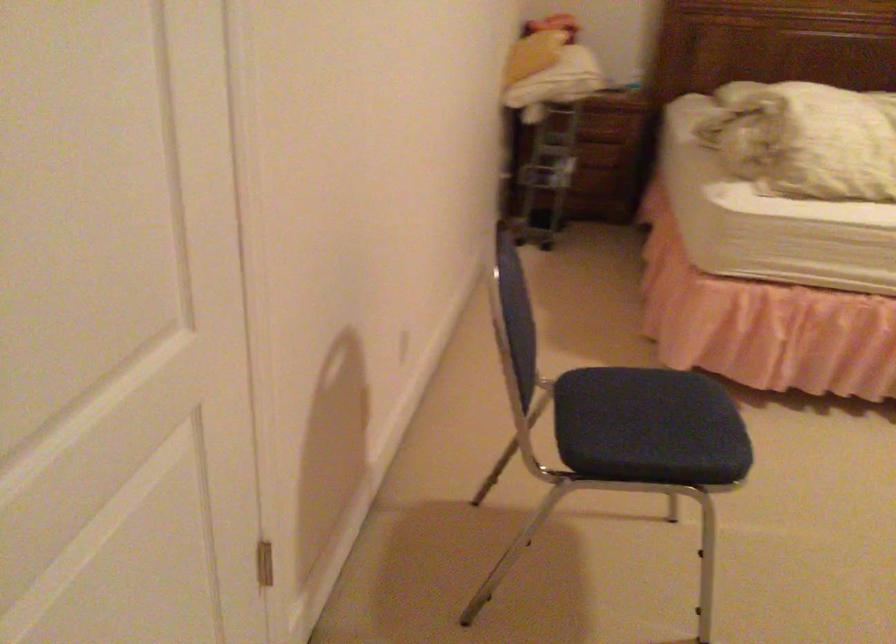
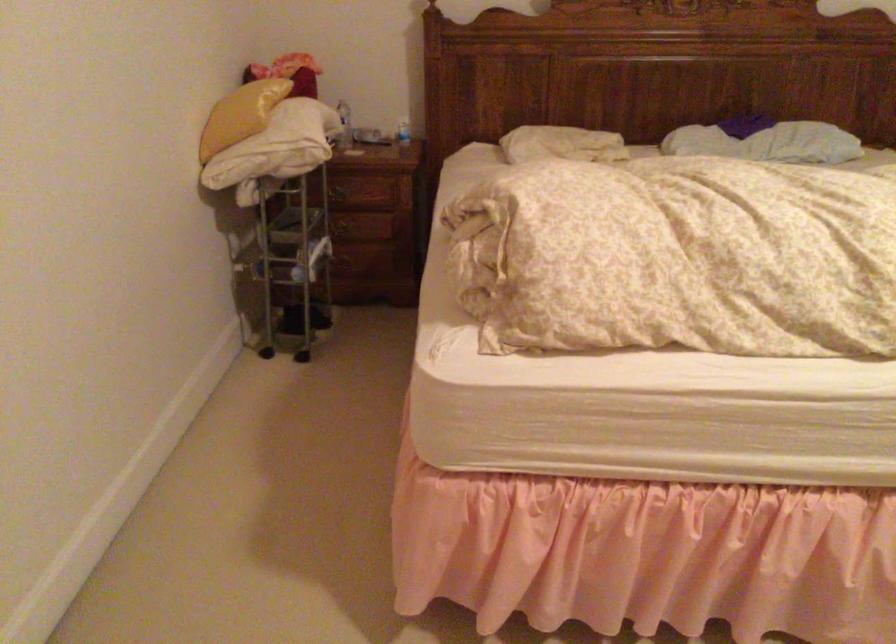
In the second image, find the point that corresponds to [565,140] in the first image.

(342, 230)